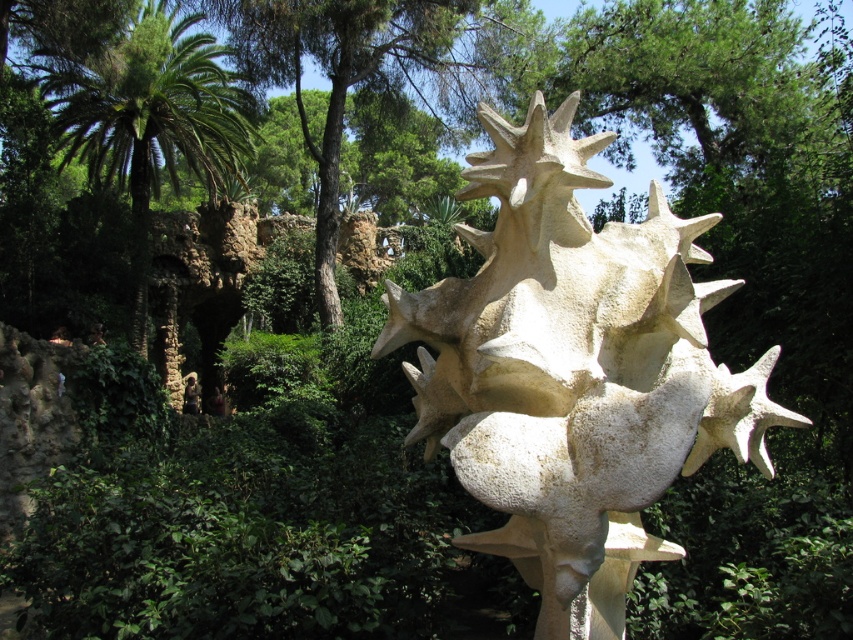
Question: Is white stone sculpture at center closer to the viewer compared to green leafy palm at left?

Choices:
 (A) no
 (B) yes

Answer: (B)

Question: Which point is farther from the camera taking this photo?

Choices:
 (A) (566, 452)
 (B) (83, 65)
 (C) (473, 58)

Answer: (C)

Question: In this image, where is green leafy tree at upper center located relative to green leafy palm at left?

Choices:
 (A) left
 (B) right

Answer: (B)

Question: Among these points, which one is farthest from the camera?

Choices:
 (A) (310, 36)
 (B) (671, 292)
 (C) (164, 65)

Answer: (C)

Question: Among these objects, which one is farthest from the camera?

Choices:
 (A) white stone sculpture at center
 (B) green leafy palm at left

Answer: (B)

Question: Does white stone sculpture at center have a smaller size compared to green leafy palm at left?

Choices:
 (A) no
 (B) yes

Answer: (A)